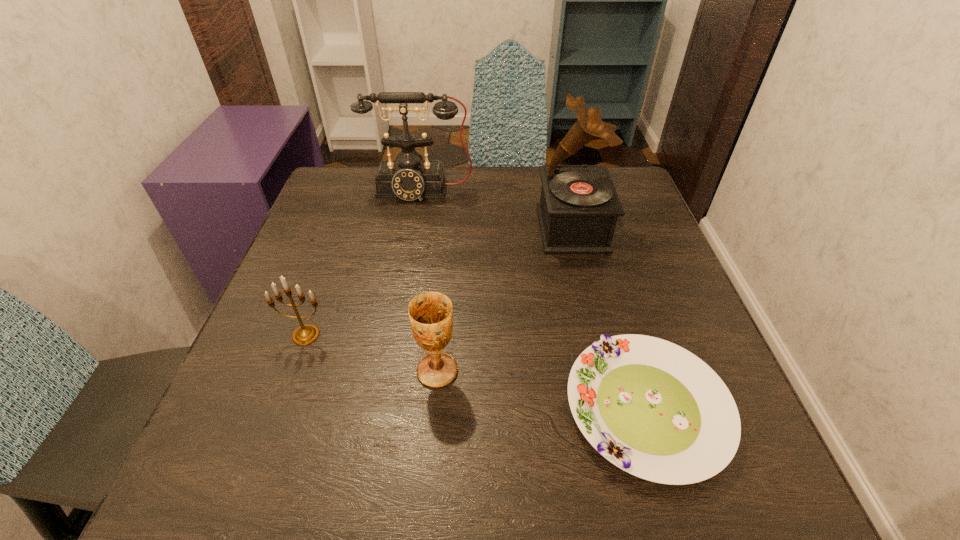
The width and height of the screenshot is (960, 540). Identify the location of free space located 0.230m on the dial of the telephone. (406, 265).

Locate an element on the screen. Image resolution: width=960 pixels, height=540 pixels. free space located 0.310m on the back of the chalice is located at coordinates (448, 241).

Identify the location of free spot located on the back of the candelabrum. coord(328,273).

I want to click on blank area located 0.050m on the back of the shortest object, so click(621, 322).

Locate an element on the screen. The image size is (960, 540). phonograph_record that is positioned at the far edge is located at coordinates (579, 206).

The width and height of the screenshot is (960, 540). I want to click on telephone at the far edge, so click(x=409, y=177).

Locate an element on the screen. Image resolution: width=960 pixels, height=540 pixels. object that is at the near edge is located at coordinates (652, 408).

The image size is (960, 540). I want to click on telephone at the left edge, so click(409, 177).

Locate an element on the screen. The height and width of the screenshot is (540, 960). candelabrum that is at the left edge is located at coordinates (306, 334).

Where is `phonograph_record that is at the right edge`? Image resolution: width=960 pixels, height=540 pixels. phonograph_record that is at the right edge is located at coordinates (579, 206).